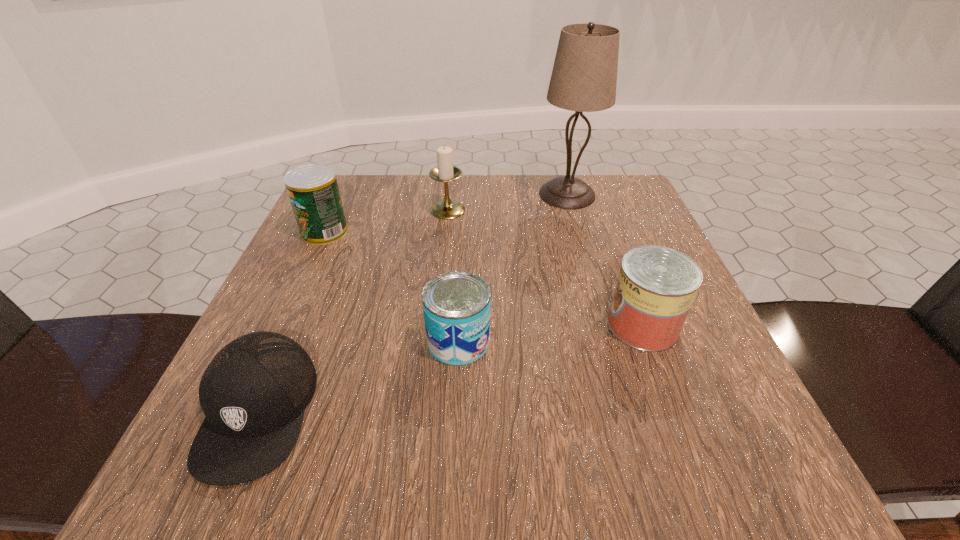
Locate an element on the screen. This screenshot has width=960, height=540. free space between the farthest can and the rightmost can is located at coordinates (484, 279).

Where is `unoccupied area between the cap and the candle holder`? Image resolution: width=960 pixels, height=540 pixels. unoccupied area between the cap and the candle holder is located at coordinates (352, 310).

You are a GUI agent. You are given a task and a screenshot of the screen. Output one action in this format:
    pyautogui.click(x=<x>, y=<y>)
    Task: Click on the free space between the cap and the shortest can
    
    Given the screenshot: What is the action you would take?
    pyautogui.click(x=358, y=376)

You are a GUI agent. You are given a task and a screenshot of the screen. Output one action in this format:
    pyautogui.click(x=<x>, y=<y>)
    Task: Click on the free spot between the rightmost can and the farthest can
    The height and width of the screenshot is (540, 960).
    Given the screenshot: What is the action you would take?
    pyautogui.click(x=484, y=279)

This screenshot has width=960, height=540. What are the coordinates of `unoccupied position between the second can from right to left and the leftmost can` in the screenshot? It's located at [392, 287].

Identify the location of free area in between the cap and the rightmost can. (450, 368).

At what (x,y) coordinates should I click in order to perform the action: click on vacant space in between the fifth shortest object and the leftmost can. Please return your answer as a coordinate pair (x, y). Looking at the image, I should click on (386, 221).

This screenshot has width=960, height=540. I want to click on free space between the cap and the shortest can, so click(358, 376).

Locate which object ranks third in proximity to the shortest can. Please provide its 2D coordinates. Your answer should be formatted as a tuple, i.e. [(x, y)], where the tuple contains the x and y coordinates of a point satisfying the conditions above.

[(313, 190)]

Identify which object is located as the second nearest to the cap. Please provide its 2D coordinates. Your answer should be formatted as a tuple, i.e. [(x, y)], where the tuple contains the x and y coordinates of a point satisfying the conditions above.

[(313, 190)]